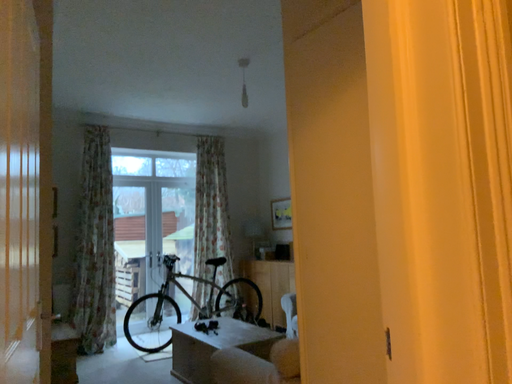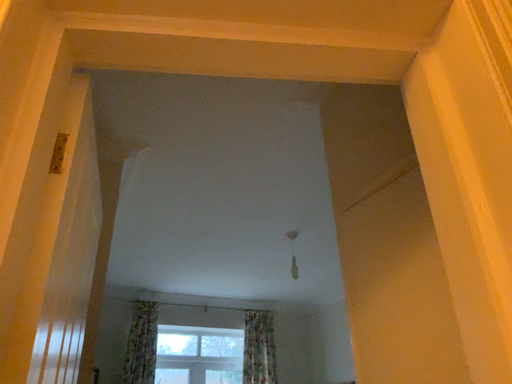
Question: How did the camera likely rotate when shooting the video?

Choices:
 (A) rotated right
 (B) rotated left

Answer: (B)